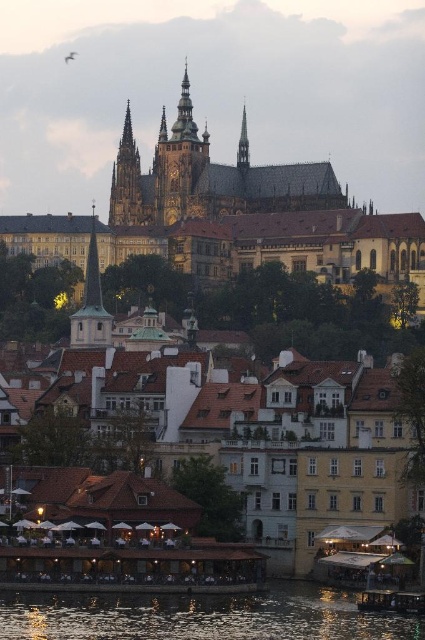
Is reflective glass water at lower center to the left of smooth gold spire at upper center from the viewer's perspective?

Correct, you'll find reflective glass water at lower center to the left of smooth gold spire at upper center.

Who is lower down, reflective glass water at lower center or smooth gold spire at upper center?

Positioned lower is reflective glass water at lower center.

Measure the distance between reflective glass water at lower center and camera.

reflective glass water at lower center and camera are 60.53 meters apart from each other.

What are the coordinates of `reflective glass water at lower center` in the screenshot? It's located at (201, 616).

Does golden ornate tower at center have a lesser height compared to smooth gold spire at upper center?

In fact, golden ornate tower at center may be taller than smooth gold spire at upper center.

Is point (158, 168) farther from camera compared to point (240, 147)?

No, it is in front of (240, 147).

The image size is (425, 640). What are the coordinates of `golden ornate tower at center` in the screenshot? It's located at (180, 164).

You are a GUI agent. You are given a task and a screenshot of the screen. Output one action in this format:
    pyautogui.click(x=<x>, y=<y>)
    Task: Click on the golden ornate tower at center
    
    Given the screenshot: What is the action you would take?
    pyautogui.click(x=180, y=164)

Can you confirm if golden ornate tower at center is wider than golden stone spire at upper center?

Yes, golden ornate tower at center is wider than golden stone spire at upper center.

Describe the element at coordinates (180, 164) in the screenshot. I see `golden ornate tower at center` at that location.

Find the location of a particular element. The width and height of the screenshot is (425, 640). golden ornate tower at center is located at coordinates (180, 164).